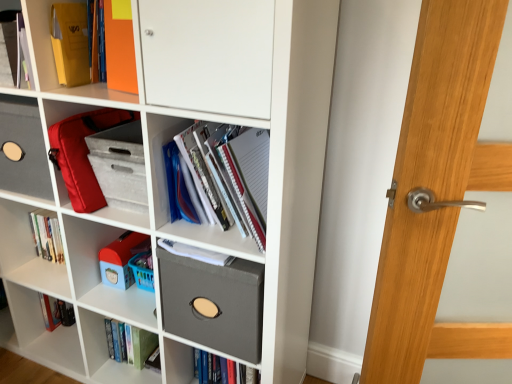
The image size is (512, 384). What do you see at coordinates (121, 259) in the screenshot?
I see `plastic toy at lower left` at bounding box center [121, 259].

In order to face matte gray fabric storage bin at center, should I rotate leftwards or rightwards?

You should rotate left by 19.607 degrees.

This screenshot has width=512, height=384. What do you see at coordinates (129, 343) in the screenshot?
I see `green matte book at lower center, the 2th book viewed from the right` at bounding box center [129, 343].

Identify the location of matte red bag at center-left, the second shelf in the right-to-left sequence. (64, 110).

The height and width of the screenshot is (384, 512). Find the location of `white paper notebook at center, which is counted as the second book, starting from the back`. white paper notebook at center, which is counted as the second book, starting from the back is located at coordinates (226, 178).

Which object is closer to the camera taking this photo, orange matte folder at upper left, placed as the 1th shelf when sorted from top to bottom, or white paper notebook at center, placed as the 2th book when sorted from left to right?

white paper notebook at center, placed as the 2th book when sorted from left to right, is in front.

Could you tell me if orange matte folder at upper left, the third shelf from the bottom, is facing white paper notebook at center, the 1th book from the right?

No, orange matte folder at upper left, the third shelf from the bottom, does not turn towards white paper notebook at center, the 1th book from the right.

Between point (61, 0) and point (197, 148), which one is positioned in front?

The point (197, 148) is more forward.

From the image's perspective, relative to white paper notebook at center, the 1th book from the right, is orange matte folder at upper left, acting as the 1th shelf starting from the left, above or below?

orange matte folder at upper left, acting as the 1th shelf starting from the left, is situated higher than white paper notebook at center, the 1th book from the right, in the image.

Is point (256, 243) farther from camera compared to point (64, 117)?

No.

Is white paper notebook at center, which appears as the first book when viewed from the top, oriented towards matte red bag at center-left, which is the second shelf in bottom-to-top order?

No, white paper notebook at center, which appears as the first book when viewed from the top, is not aimed at matte red bag at center-left, which is the second shelf in bottom-to-top order.

Measure the distance between white paper notebook at center, the 1th book from the right, and matte red bag at center-left, which is the 2th shelf from left to right.

white paper notebook at center, the 1th book from the right, and matte red bag at center-left, which is the 2th shelf from left to right, are 14.35 inches apart.

From a real-world perspective, is white paper notebook at center, which appears as the first book when viewed from the top, beneath matte red bag at center-left, which is the second shelf in bottom-to-top order?

Actually, white paper notebook at center, which appears as the first book when viewed from the top, is physically above matte red bag at center-left, which is the second shelf in bottom-to-top order, in the real world.

Is green matte book at lower center, which is counted as the 1th book, starting from the back, in front of white paper notebook at center, which appears as the first book when viewed from the top?

No, green matte book at lower center, which is counted as the 1th book, starting from the back, is further to the viewer.

Is point (118, 339) positioned in front of point (223, 179)?

No, (118, 339) is behind (223, 179).

From the picture: Considering the positions of objects green matte book at lower center, marked as the 1th book in a bottom-to-top arrangement, and white paper notebook at center, the 1th book from the right, in the image provided, who is more to the left, green matte book at lower center, marked as the 1th book in a bottom-to-top arrangement, or white paper notebook at center, the 1th book from the right,?

green matte book at lower center, marked as the 1th book in a bottom-to-top arrangement, is more to the left.

Consider the image. Considering the relative sizes of plastic toy at lower left and matte red bag at center-left, the second shelf in the right-to-left sequence, in the image provided, is plastic toy at lower left smaller than matte red bag at center-left, the second shelf in the right-to-left sequence,?

Yes.

In terms of width, does plastic toy at lower left look wider or thinner when compared to matte red bag at center-left, the second shelf in the right-to-left sequence?

In the image, plastic toy at lower left appears to be more narrow than matte red bag at center-left, the second shelf in the right-to-left sequence.

Which object is positioned more to the left, plastic toy at lower left or matte red bag at center-left, which is the second shelf in bottom-to-top order?

Positioned to the left is matte red bag at center-left, which is the second shelf in bottom-to-top order.

Is plastic toy at lower left positioned with its back to matte red bag at center-left, the second shelf in the right-to-left sequence?

No, plastic toy at lower left is not facing away from matte red bag at center-left, the second shelf in the right-to-left sequence.

From the image's perspective, is orange matte folder at upper left, the third shelf from the bottom, above plastic toy at lower left?

Yes, from the image's perspective, orange matte folder at upper left, the third shelf from the bottom, is over plastic toy at lower left.

Who is taller, orange matte folder at upper left, the third shelf from the bottom, or plastic toy at lower left?

orange matte folder at upper left, the third shelf from the bottom, is taller.

From a real-world perspective, is orange matte folder at upper left, acting as the 1th shelf starting from the left, above or below plastic toy at lower left?

In terms of real-world spatial position, orange matte folder at upper left, acting as the 1th shelf starting from the left, is above plastic toy at lower left.

Is orange matte folder at upper left, placed as the 1th shelf when sorted from top to bottom, not inside plastic toy at lower left?

Yes, orange matte folder at upper left, placed as the 1th shelf when sorted from top to bottom, is not within plastic toy at lower left.

Can you confirm if green matte book at lower center, the first book in the left-to-right sequence, is bigger than matte red bag at center-left, which is the second shelf in bottom-to-top order?

No.

Which point is more forward, [112,347] or [51,121]?

The point [51,121] is closer.

From a real-world perspective, is green matte book at lower center, which is counted as the 1th book, starting from the back, beneath matte red bag at center-left, which is counted as the second shelf, starting from the top?

Yes.

Would you say orange matte folder at upper left, acting as the 1th shelf starting from the left, is inside or outside matte gray fabric storage bin at center?

orange matte folder at upper left, acting as the 1th shelf starting from the left, is spatially positioned inside matte gray fabric storage bin at center.

Which is closer, (52,58) or (284,252)?

The point (284,252) is closer to the camera.

Is orange matte folder at upper left, placed as the 1th shelf when sorted from top to bottom, positioned far away from matte gray fabric storage bin at center?

No, orange matte folder at upper left, placed as the 1th shelf when sorted from top to bottom, is not far away from matte gray fabric storage bin at center.

How far apart are orange matte folder at upper left, placed as the 1th shelf when sorted from top to bottom, and matte gray fabric storage bin at center?

The distance of orange matte folder at upper left, placed as the 1th shelf when sorted from top to bottom, from matte gray fabric storage bin at center is 16.41 inches.

You are a GUI agent. You are given a task and a screenshot of the screen. Output one action in this format:
    pyautogui.click(x=<x>, y=<y>)
    Task: Click on the 1st book positioned below the orange matte folder at upper left, placed as the 1th shelf when sorted from top to bottom (from a real-world perspective)
    
    Given the screenshot: What is the action you would take?
    pyautogui.click(x=226, y=178)

You are a GUI agent. You are given a task and a screenshot of the screen. Output one action in this format:
    pyautogui.click(x=<x>, y=<y>)
    Task: Click on the 1st book below when counting from the matte red bag at center-left, the second shelf in the right-to-left sequence (from the image's perspective)
    
    Given the screenshot: What is the action you would take?
    pyautogui.click(x=226, y=178)

When comparing their distances from orange matte folder at upper left, the third shelf from the bottom, does white paper notebook at center, which appears as the first book when viewed from the top, or matte gray fabric box at center, which is the third shelf in top-to-bottom order, seem closer?

white paper notebook at center, which appears as the first book when viewed from the top.

Estimate the real-world distances between objects in this image. Which object is further from matte red bag at center-left, which is counted as the second shelf, starting from the top, matte gray fabric box at center, which is counted as the third shelf, starting from the left, or green matte book at lower center, the first book in the left-to-right sequence?

green matte book at lower center, the first book in the left-to-right sequence, is further to matte red bag at center-left, which is counted as the second shelf, starting from the top.

From the image, which object appears to be nearer to matte gray fabric box at center, the first shelf ordered from the bottom, matte gray fabric storage bin at center or plastic toy at lower left?

matte gray fabric storage bin at center.

Which object lies nearer to the anchor point white paper notebook at center, which is the second book from bottom to top, green matte book at lower center, the 2th book viewed from the right, or orange matte folder at upper left, the third shelf from the bottom?

Among the two, orange matte folder at upper left, the third shelf from the bottom, is located nearer to white paper notebook at center, which is the second book from bottom to top.

Looking at the image, which one is located further to matte gray fabric box at center, which is counted as the third shelf, starting from the left, green matte book at lower center, the 2th book viewed from the right, or plastic toy at lower left?

Among the two, green matte book at lower center, the 2th book viewed from the right, is located further to matte gray fabric box at center, which is counted as the third shelf, starting from the left.

From the image, which object appears to be nearer to matte red bag at center-left, which is the 2th shelf from left to right, orange matte folder at upper left, the third shelf from the bottom, or white paper notebook at center, which appears as the first book when viewed from the top?

orange matte folder at upper left, the third shelf from the bottom, is closer to matte red bag at center-left, which is the 2th shelf from left to right.

When comparing their distances from green matte book at lower center, the first book in the left-to-right sequence, does orange matte folder at upper left, acting as the 1th shelf starting from the left, or white paper notebook at center, the 1th book from the right, seem closer?

Based on the image, white paper notebook at center, the 1th book from the right, appears to be nearer to green matte book at lower center, the first book in the left-to-right sequence.

Which object lies further to the anchor point matte gray fabric storage bin at center, matte red bag at center-left, which is counted as the second shelf, starting from the top, or white paper notebook at center, which appears as the first book when viewed from the top?

matte red bag at center-left, which is counted as the second shelf, starting from the top, is further to matte gray fabric storage bin at center.

Locate an element on the screen. This screenshot has width=512, height=384. bookcase between orange matte folder at upper left, acting as the third shelf starting from the right, and white paper notebook at center, which appears as the first book when viewed from the top, from left to right is located at coordinates (165, 179).

Where is `toy between matte red bag at center-left, which is the second shelf in bottom-to-top order, and green matte book at lower center, the first book in the left-to-right sequence, from top to bottom`? The height and width of the screenshot is (384, 512). toy between matte red bag at center-left, which is the second shelf in bottom-to-top order, and green matte book at lower center, the first book in the left-to-right sequence, from top to bottom is located at coordinates (121, 259).

The width and height of the screenshot is (512, 384). I want to click on toy between matte gray fabric box at center, the first shelf ordered from the bottom, and green matte book at lower center, the 2th book viewed from the right, from front to back, so click(121, 259).

The width and height of the screenshot is (512, 384). I want to click on book between orange matte folder at upper left, placed as the 1th shelf when sorted from top to bottom, and green matte book at lower center, the 2th book viewed from the right, from top to bottom, so click(x=226, y=178).